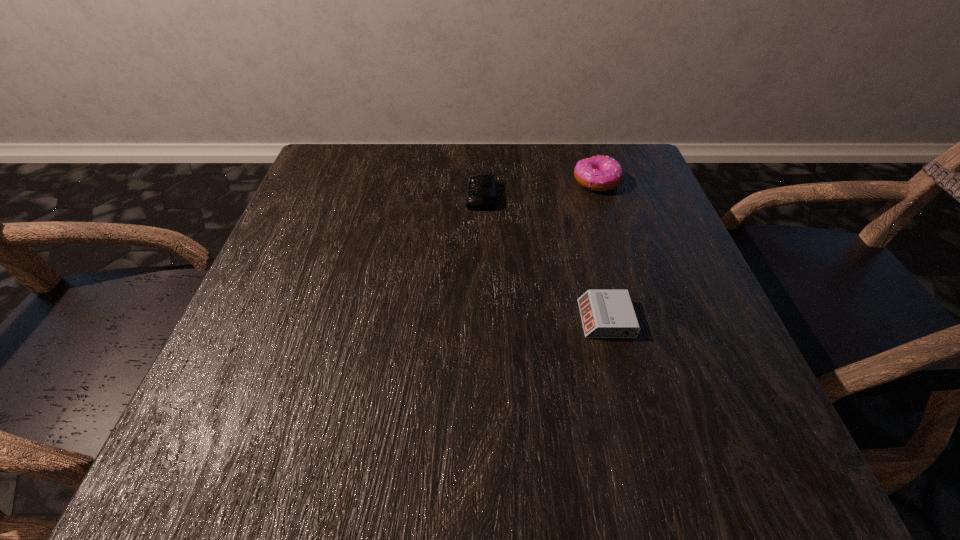
In the image, there is a desktop. Where is `free space at the near left corner`? free space at the near left corner is located at coordinates (294, 472).

This screenshot has height=540, width=960. Find the location of `vacant area that lies between the tallest object and the nearer alarm clock`. vacant area that lies between the tallest object and the nearer alarm clock is located at coordinates (601, 251).

This screenshot has width=960, height=540. What are the coordinates of `empty location between the farther alarm clock and the right alarm clock` in the screenshot? It's located at [543, 258].

Locate an element on the screen. free point between the right alarm clock and the left alarm clock is located at coordinates (543, 258).

Find the location of a particular element. This screenshot has height=540, width=960. free space between the left alarm clock and the doughnut is located at coordinates (539, 189).

I want to click on empty space between the doughnut and the leftmost object, so click(x=539, y=189).

Locate an element on the screen. The width and height of the screenshot is (960, 540). vacant region between the leftmost object and the tallest object is located at coordinates (539, 189).

The width and height of the screenshot is (960, 540). Identify the location of vacant space that's between the nearer alarm clock and the doughnut. (601, 251).

Locate an element on the screen. vacant region between the nearest object and the tallest object is located at coordinates (601, 251).

At what (x,y) coordinates should I click in order to perform the action: click on free point between the tallest object and the nearer alarm clock. Please return your answer as a coordinate pair (x, y). The image size is (960, 540). Looking at the image, I should click on (601, 251).